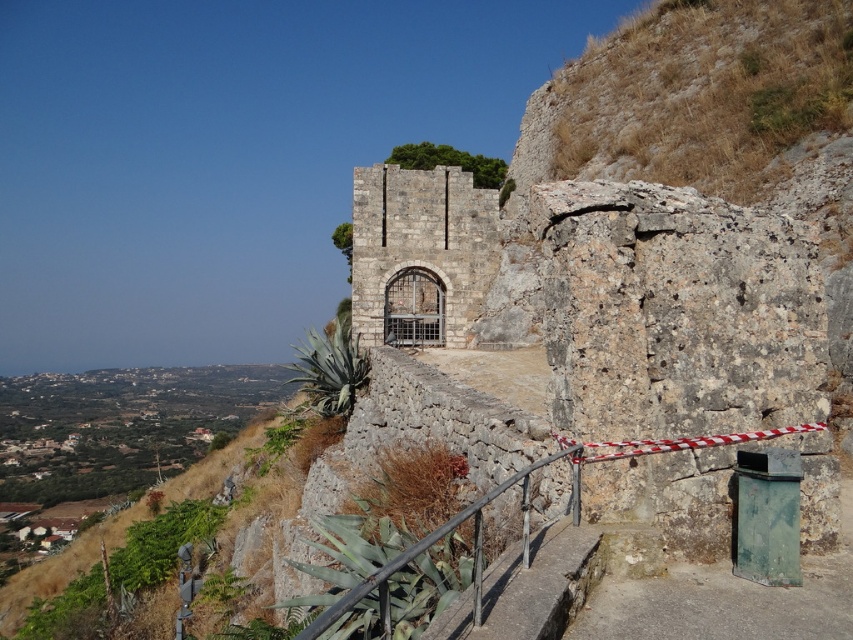
Question: Which point appears closest to the camera in this image?

Choices:
 (A) (485, 499)
 (B) (393, 244)

Answer: (A)

Question: Is rustic stone gate at center smaller than rustic metal railing at center?

Choices:
 (A) yes
 (B) no

Answer: (B)

Question: Is rustic stone gate at center to the right of rustic metal railing at center from the viewer's perspective?

Choices:
 (A) no
 (B) yes

Answer: (A)

Question: From the image, what is the correct spatial relationship of rustic stone gate at center in relation to rustic metal railing at center?

Choices:
 (A) right
 (B) left

Answer: (B)

Question: Which point is farther to the camera?

Choices:
 (A) rustic stone gate at center
 (B) rustic metal railing at center

Answer: (A)

Question: Which point is closer to the camera?

Choices:
 (A) (395, 262)
 (B) (578, 460)

Answer: (B)